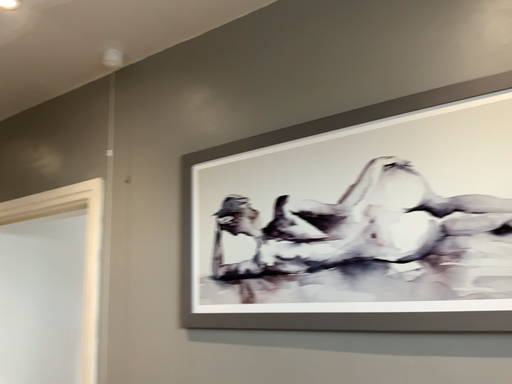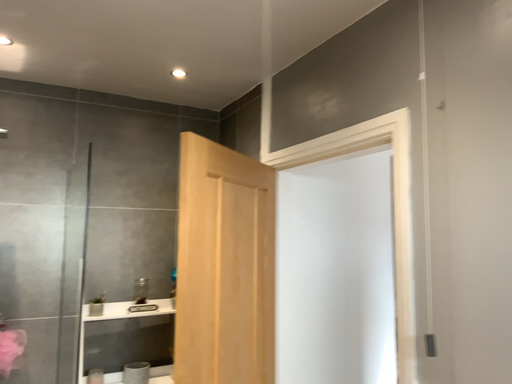
Question: Which way did the camera rotate in the video?

Choices:
 (A) rotated upward
 (B) rotated downward

Answer: (B)